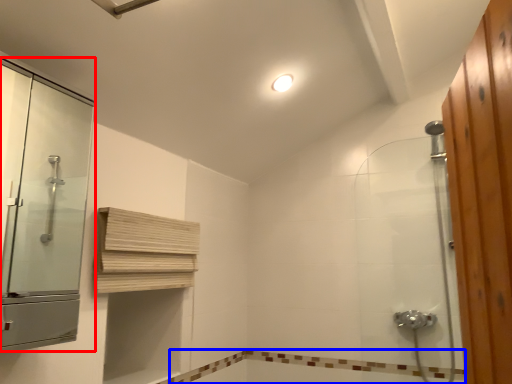
Question: Which object is further to the camera taking this photo, screen door (highlighted by a red box) or bath (highlighted by a blue box)?

Choices:
 (A) screen door
 (B) bath

Answer: (B)